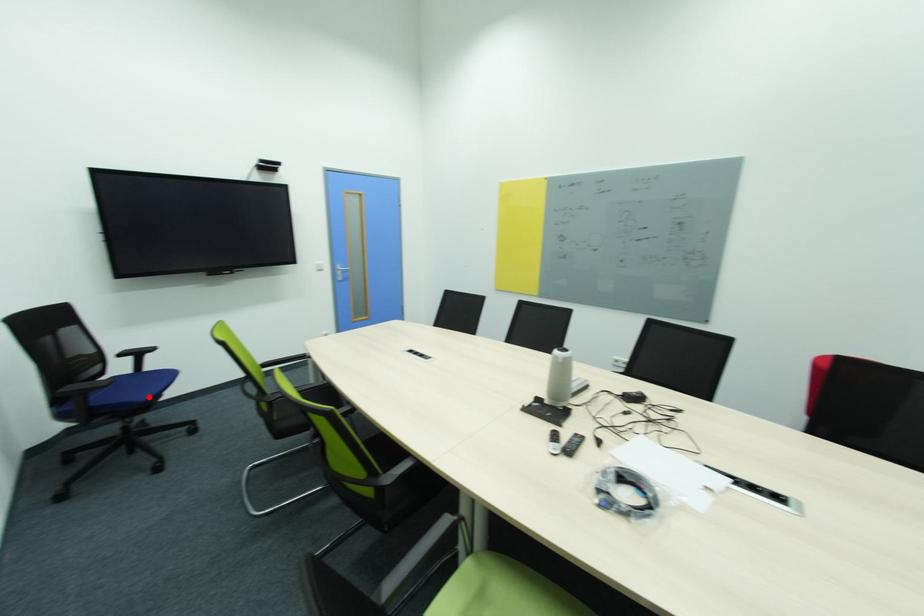
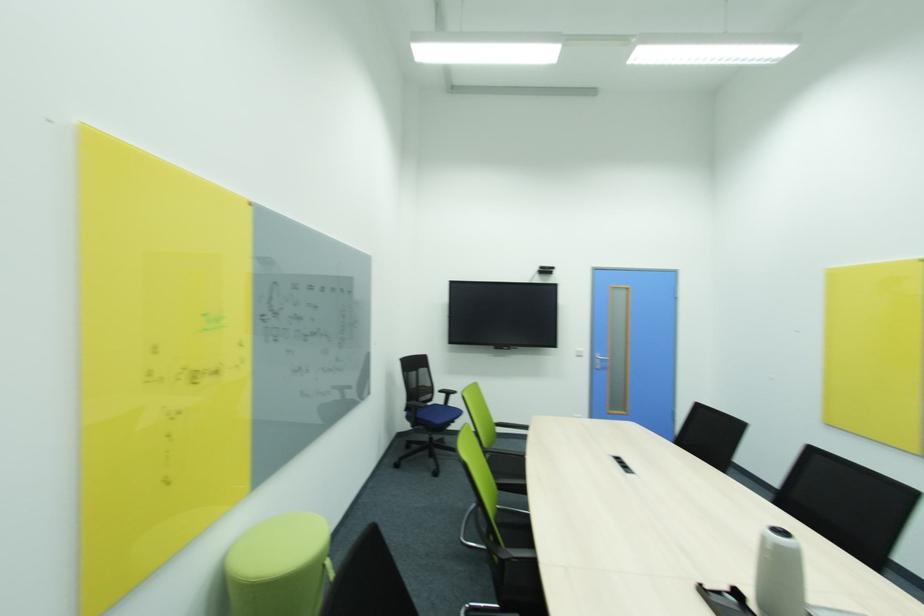
Where in the second image is the point corresponding to the highlighted location from the first image?

(442, 422)